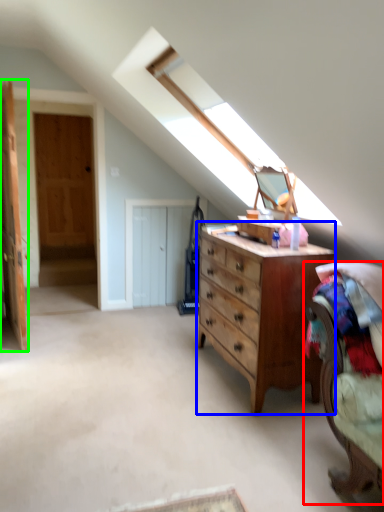
Question: Which object is positioned farthest from armchair (highlighted by a red box)? Select from chest of drawers (highlighted by a blue box) and door (highlighted by a green box).

Choices:
 (A) chest of drawers
 (B) door

Answer: (B)